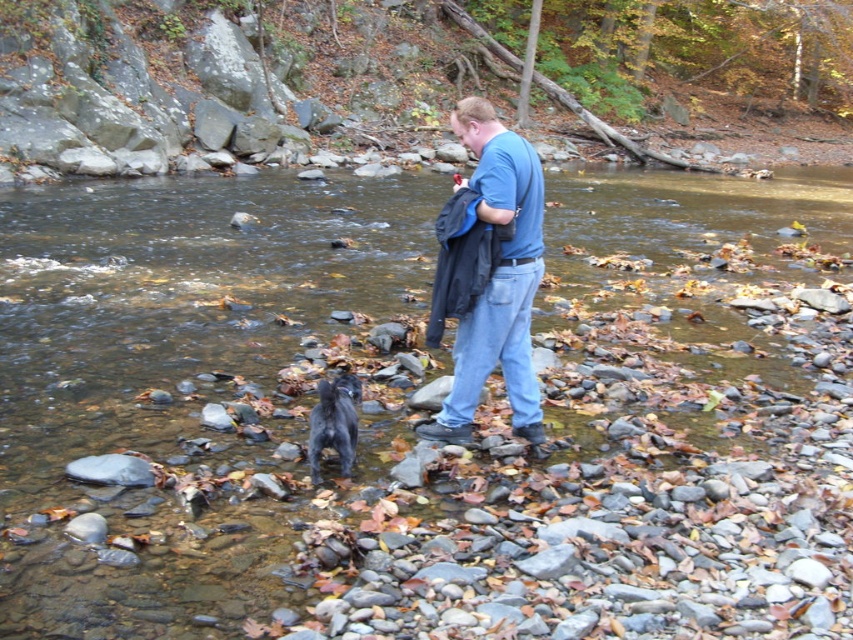
Does smooth rock creek at center come behind shiny black fur at center?

No, smooth rock creek at center is closer to the viewer.

At what (x,y) coordinates should I click in order to perform the action: click on smooth rock creek at center. Please return your answer as a coordinate pair (x, y). The height and width of the screenshot is (640, 853). Looking at the image, I should click on (421, 413).

Which is in front, point (308, 355) or point (326, 445)?

Point (326, 445) is in front.

Where is `smooth rock creek at center`? This screenshot has height=640, width=853. smooth rock creek at center is located at coordinates (421, 413).

What do you see at coordinates (488, 275) in the screenshot? Image resolution: width=853 pixels, height=640 pixels. I see `blue cotton shirt at center` at bounding box center [488, 275].

Is the position of blue cotton shirt at center more distant than that of shiny black fur at center?

Yes, it is.

Locate an element on the screen. blue cotton shirt at center is located at coordinates (488, 275).

In the scene shown: Which is more to the right, smooth rock creek at center or blue cotton shirt at center?

From the viewer's perspective, smooth rock creek at center appears more on the right side.

Between point (585, 289) and point (480, 308), which one is positioned behind?

Positioned behind is point (585, 289).

Describe the element at coordinates (421, 413) in the screenshot. I see `smooth rock creek at center` at that location.

I want to click on smooth rock creek at center, so [x=421, y=413].